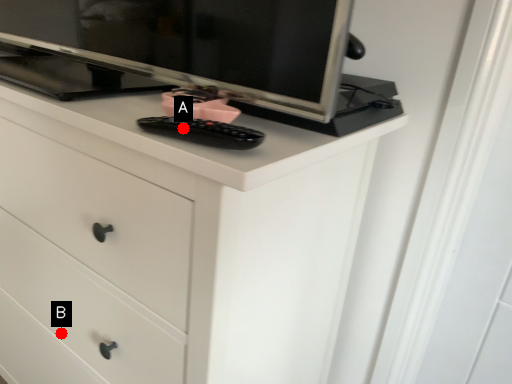
Question: Two points are circled on the image, labeled by A and B beside each circle. Which point is further to the camera?

Choices:
 (A) A is further
 (B) B is further

Answer: (B)